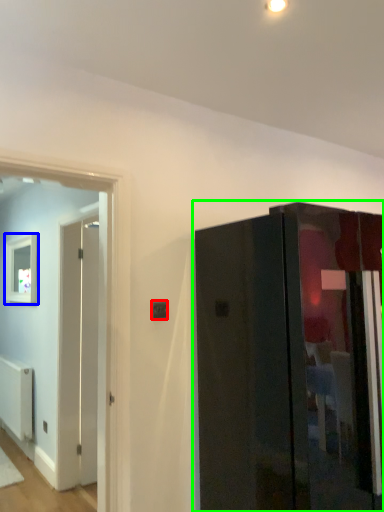
Question: Based on their relative distances, which object is nearer to electric outlet (highlighted by a red box)? Choose from picture frame (highlighted by a blue box) and door (highlighted by a green box).

Choices:
 (A) picture frame
 (B) door

Answer: (B)